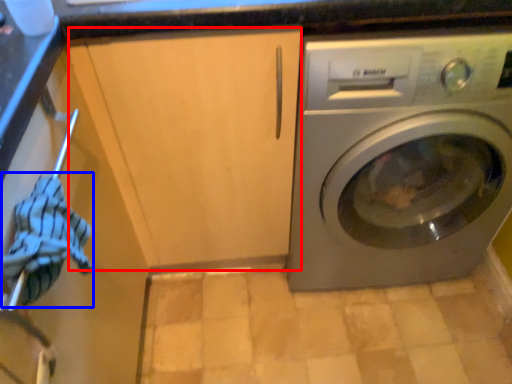
Question: Which object appears closest to the camera in this image, cabinetry (highlighted by a red box) or clothing (highlighted by a blue box)?

Choices:
 (A) cabinetry
 (B) clothing

Answer: (B)